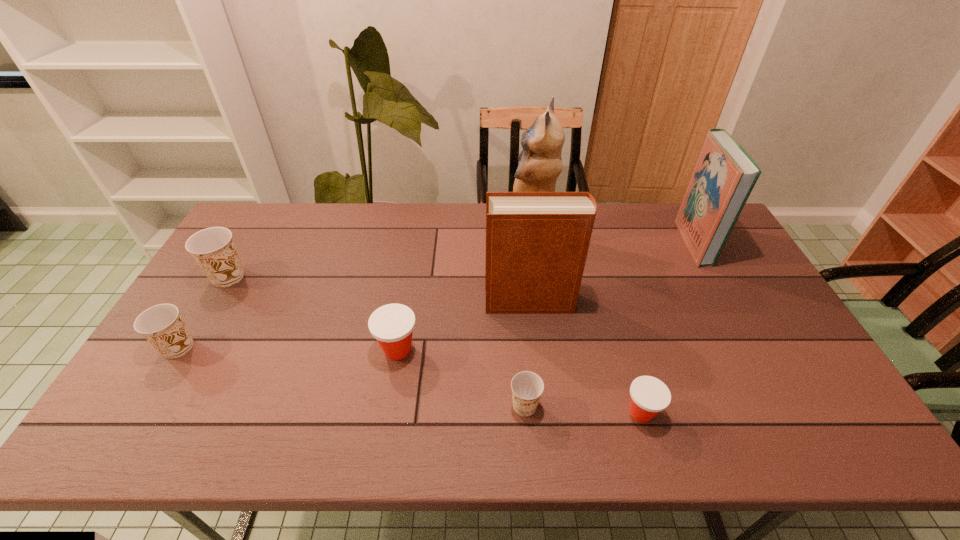
This screenshot has width=960, height=540. I want to click on free spot that satisfies the following two spatial constraints: 1. on the open cover of the nearer hardback book; 2. on the left side of the right red-orange Dixie cup, so click(x=543, y=413).

Where is `free point that satisfies the following two spatial constraints: 1. on the open cover of the nearer hardback book; 2. on the front side of the second smallest orange Dixie cup`? The width and height of the screenshot is (960, 540). free point that satisfies the following two spatial constraints: 1. on the open cover of the nearer hardback book; 2. on the front side of the second smallest orange Dixie cup is located at coordinates (536, 347).